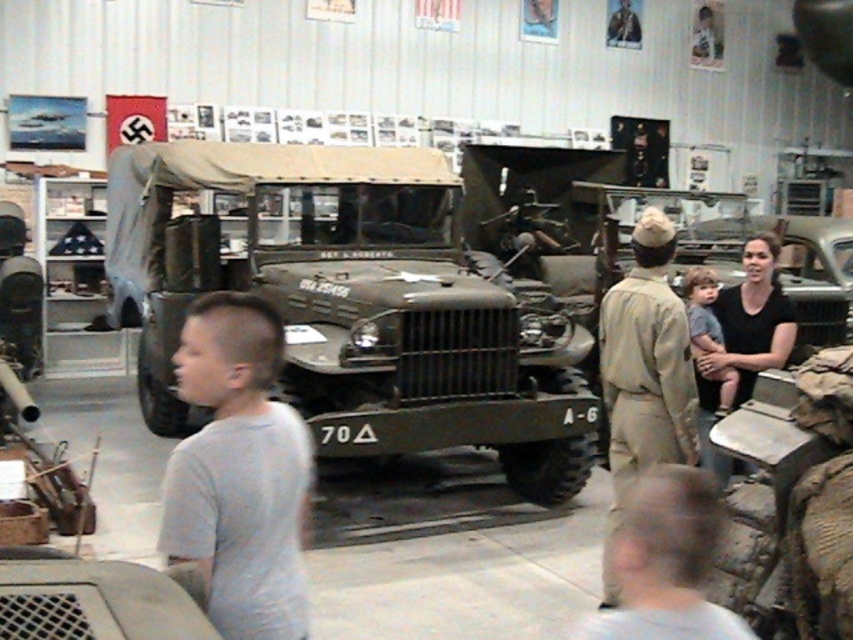
You are standing in the museum and want to ask the person in the tan uniform at center for directions. Where should you look to find them?

The tan uniform at center is located at point (643, 371), so you should look towards that coordinate to find them.

You are a security guard in the museum and need to monitor both the tan uniform at center and the black cotton shirt at right. From your vantage point, which direction should you face to keep both in view?

You should face towards the right side of the museum because the tan uniform at center is to the left of the black cotton shirt at right, so facing right allows you to see both to your left and right.